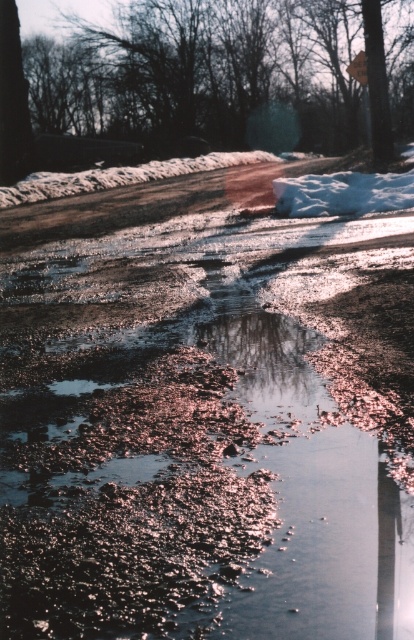
I want to click on brown textured tree at upper center, so click(209, 77).

Is brown textured tree at upper center thinner than metallic reflective sign at upper center?

Incorrect, brown textured tree at upper center's width is not less than metallic reflective sign at upper center's.

Is point (291, 36) farther from viewer compared to point (358, 74)?

That is True.

Find the location of a particular element. Image resolution: width=414 pixels, height=640 pixels. brown textured tree at upper center is located at coordinates (209, 77).